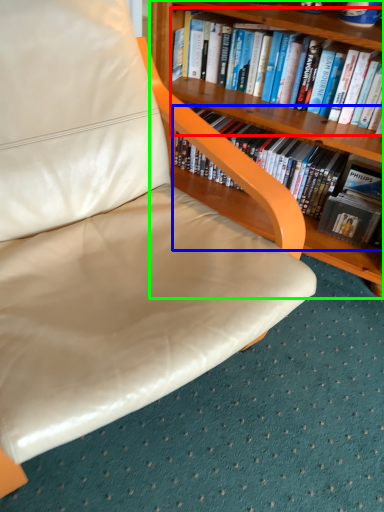
Question: Which is nearer to the book (highlighted by a red box)? book (highlighted by a blue box) or bookcase (highlighted by a green box).

Choices:
 (A) book
 (B) bookcase

Answer: (B)